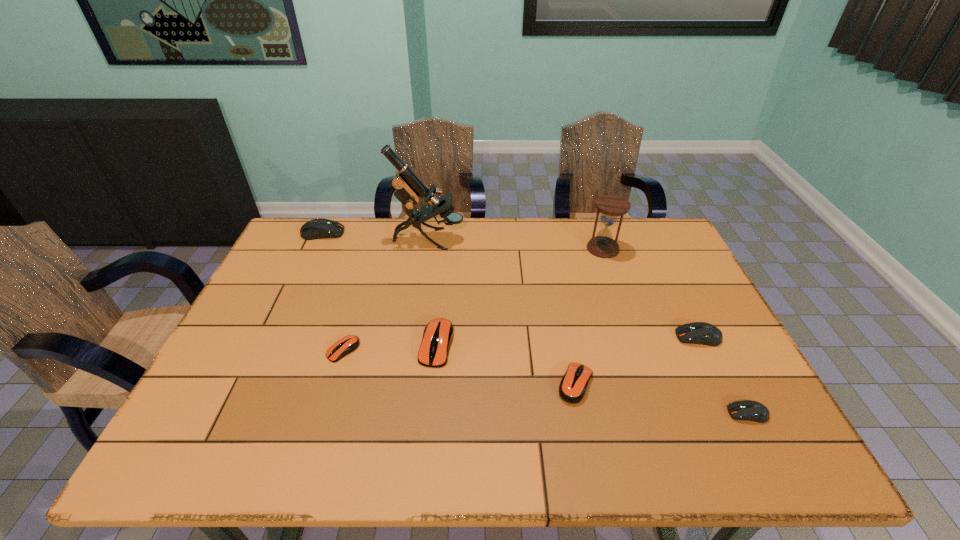
I want to click on vacant point located between the microscope and the leftmost computer mouse, so click(x=375, y=237).

Locate an element on the screen. vacant area between the biggest dark computer equipment and the second nearest dark computer equipment is located at coordinates (511, 285).

Where is `vacant area that lies between the microscope and the tallest computer mouse`? This screenshot has width=960, height=540. vacant area that lies between the microscope and the tallest computer mouse is located at coordinates (375, 237).

Find the location of a particular element. vacant point located between the second biggest dark computer equipment and the smallest dark computer equipment is located at coordinates (723, 375).

Find the location of a particular element. free space between the biggest orange computer mouse and the nearest dark computer equipment is located at coordinates (592, 379).

You are a GUI agent. You are given a task and a screenshot of the screen. Output one action in this format:
    pyautogui.click(x=<x>, y=<y>)
    Task: Click on the vacant space that is in between the third computer mouse from right to left and the tallest object
    The width and height of the screenshot is (960, 540).
    Given the screenshot: What is the action you would take?
    pyautogui.click(x=502, y=312)

The image size is (960, 540). In order to click on the seventh closest object to the shortest computer mouse in this screenshot , I will do `click(747, 410)`.

You are a GUI agent. You are given a task and a screenshot of the screen. Output one action in this format:
    pyautogui.click(x=<x>, y=<y>)
    Task: Click on the object that can be found as the second closest to the microscope
    The image size is (960, 540).
    Given the screenshot: What is the action you would take?
    pyautogui.click(x=438, y=334)

Locate which computer mouse is the third closest to the fourth computer mouse from right to left. Please provide its 2D coordinates. Your answer should be formatted as a tuple, i.e. [(x, y)], where the tuple contains the x and y coordinates of a point satisfying the conditions above.

[(320, 228)]

Where is `computer mouse that stands as the fourth closest to the smallest dark computer equipment`? Image resolution: width=960 pixels, height=540 pixels. computer mouse that stands as the fourth closest to the smallest dark computer equipment is located at coordinates (346, 345).